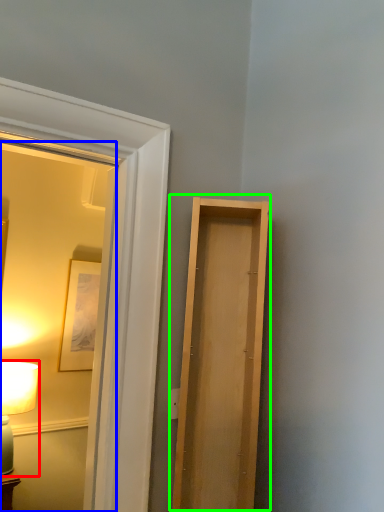
Question: Which object is positioned farthest from table lamp (highlighted by a red box)? Select from mirror (highlighted by a blue box) and door (highlighted by a green box).

Choices:
 (A) mirror
 (B) door

Answer: (B)